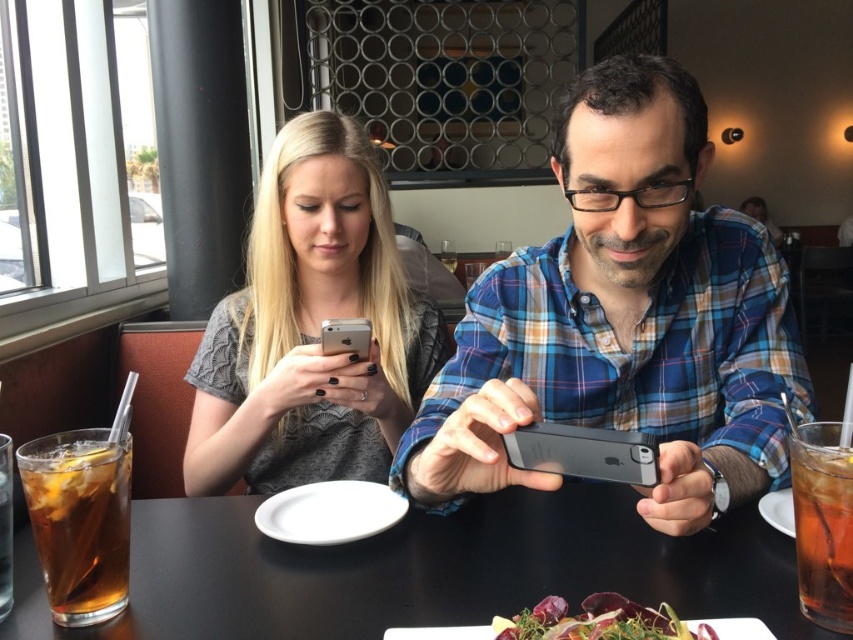
Question: Which of the following is the closest to the observer?

Choices:
 (A) brown translucent glass at table center
 (B) black glossy table at center
 (C) translucent glass drink at lower left

Answer: (A)

Question: Does black glossy table at center appear on the left side of matte silver phone at center?

Choices:
 (A) yes
 (B) no

Answer: (B)

Question: Is the position of black glossy table at center more distant than that of matte silver phone at center?

Choices:
 (A) yes
 (B) no

Answer: (B)

Question: In this image, where is matte black phone at center located relative to matte silver phone at center?

Choices:
 (A) right
 (B) left

Answer: (A)

Question: Which point appears farthest from the camera in this image?

Choices:
 (A) (334, 353)
 (B) (663, 429)

Answer: (B)

Question: Based on their relative distances, which object is nearer to the translucent glass drink at lower left?

Choices:
 (A) silver metallic smartphone at center
 (B) matte silver phone at center

Answer: (A)